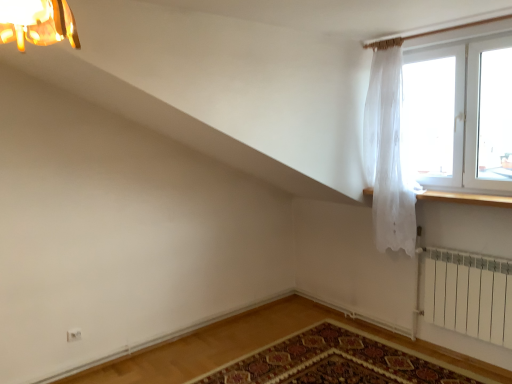
Question: Is white sheer curtain at upper right taller than transparent glass window at upper right?

Choices:
 (A) yes
 (B) no

Answer: (A)

Question: Can you confirm if white sheer curtain at upper right is positioned to the right of transparent glass window at upper right?

Choices:
 (A) no
 (B) yes

Answer: (A)

Question: Is white sheer curtain at upper right wider than transparent glass window at upper right?

Choices:
 (A) no
 (B) yes

Answer: (B)

Question: Is white sheer curtain at upper right facing towards transparent glass window at upper right?

Choices:
 (A) yes
 (B) no

Answer: (B)

Question: From the image's perspective, is white sheer curtain at upper right under transparent glass window at upper right?

Choices:
 (A) no
 (B) yes

Answer: (B)

Question: Does white sheer curtain at upper right have a smaller size compared to transparent glass window at upper right?

Choices:
 (A) no
 (B) yes

Answer: (A)

Question: Is transparent glass window at upper right outside of white sheer curtain at upper right?

Choices:
 (A) no
 (B) yes

Answer: (B)

Question: From the image's perspective, is transparent glass window at upper right beneath white sheer curtain at upper right?

Choices:
 (A) yes
 (B) no

Answer: (B)

Question: Is transparent glass window at upper right positioned far away from white sheer curtain at upper right?

Choices:
 (A) yes
 (B) no

Answer: (B)

Question: Is transparent glass window at upper right smaller than white sheer curtain at upper right?

Choices:
 (A) no
 (B) yes

Answer: (B)

Question: From a real-world perspective, is transparent glass window at upper right physically below white sheer curtain at upper right?

Choices:
 (A) yes
 (B) no

Answer: (B)

Question: Is the position of transparent glass window at upper right less distant than that of white sheer curtain at upper right?

Choices:
 (A) yes
 (B) no

Answer: (A)

Question: Would you say carpeted mat at lower center is part of transparent glass window at upper right's contents?

Choices:
 (A) no
 (B) yes

Answer: (A)